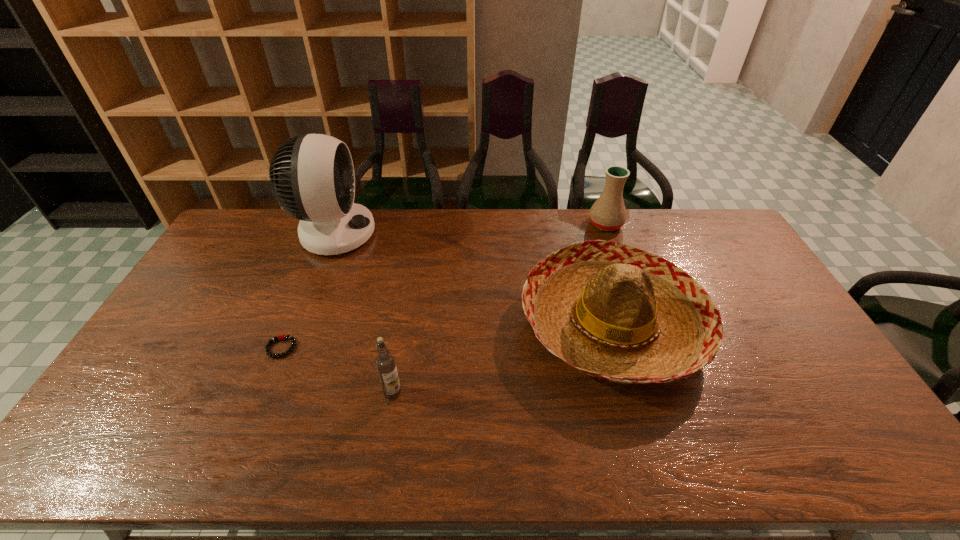
Image resolution: width=960 pixels, height=540 pixels. Find the location of `free point between the shortest object and the pottery`. free point between the shortest object and the pottery is located at coordinates (444, 286).

You are a GUI agent. You are given a task and a screenshot of the screen. Output one action in this format:
    pyautogui.click(x=<x>, y=<y>)
    Task: Click on the vacant point located between the tallest object and the pottery
    
    Given the screenshot: What is the action you would take?
    pyautogui.click(x=470, y=229)

You are a GUI agent. You are given a task and a screenshot of the screen. Output one action in this format:
    pyautogui.click(x=<x>, y=<y>)
    Task: Click on the vacant point located between the shortest object and the pottery
    
    Given the screenshot: What is the action you would take?
    pyautogui.click(x=444, y=286)

Identify the location of free space between the sombrero and the vodka. This screenshot has height=540, width=960. (502, 358).

Identify the location of free space between the vodka and the shortest object. (337, 370).

The image size is (960, 540). In order to click on vacant space in between the bracelet and the sombrero in this screenshot , I will do `click(446, 335)`.

Locate an element on the screen. free space between the fan and the shortest object is located at coordinates (308, 291).

Select which object is the third closest to the third object from right to left. Please provide its 2D coordinates. Your answer should be formatted as a tuple, i.e. [(x, y)], where the tuple contains the x and y coordinates of a point satisfying the conditions above.

[(312, 177)]

Point out which object is positioned as the second nearest to the shortest object. Please provide its 2D coordinates. Your answer should be formatted as a tuple, i.e. [(x, y)], where the tuple contains the x and y coordinates of a point satisfying the conditions above.

[(312, 177)]

Locate an element on the screen. This screenshot has width=960, height=540. vacant space that satisfies the following two spatial constraints: 1. on the grille of the tallest object; 2. on the right side of the sombrero is located at coordinates (299, 323).